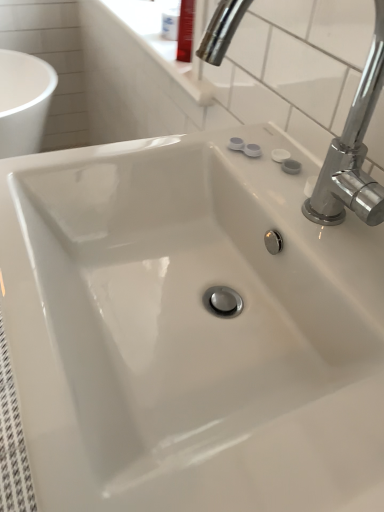
Locate an element on the screen. chrome/metallic faucet at upper right is located at coordinates pyautogui.click(x=353, y=152).

The image size is (384, 512). What do you see at coordinates (353, 152) in the screenshot?
I see `chrome/metallic faucet at upper right` at bounding box center [353, 152].

What is the approximate width of chrome/metallic faucet at upper right?

It is 5.64 inches.

Where is `chrome/metallic faucet at upper right`? chrome/metallic faucet at upper right is located at coordinates (353, 152).